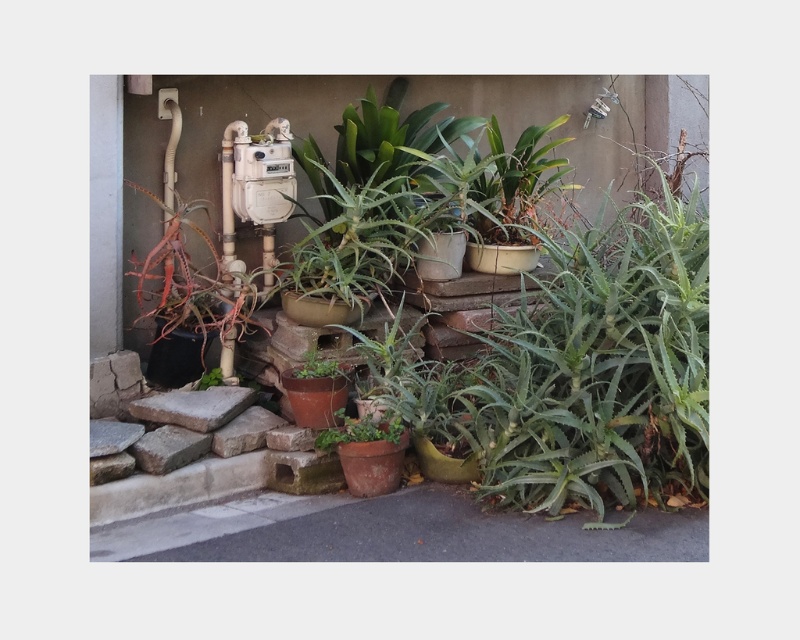
Question: Among these points, which one is farthest from the camera?

Choices:
 (A) (366, 435)
 (B) (318, 369)

Answer: (B)

Question: Is green matte pot at center to the left of green matte plant at center from the viewer's perspective?

Choices:
 (A) yes
 (B) no

Answer: (B)

Question: Among these points, which one is nearest to the camera?

Choices:
 (A) (385, 428)
 (B) (320, 364)

Answer: (A)

Question: Does green matte pot at center have a greater width compared to green matte plant at center?

Choices:
 (A) yes
 (B) no

Answer: (A)

Question: Does green matte pot at center lie in front of green matte plant at center?

Choices:
 (A) yes
 (B) no

Answer: (A)

Question: Which object is closer to the camera taking this photo?

Choices:
 (A) green matte pot at center
 (B) green matte plant at center

Answer: (A)